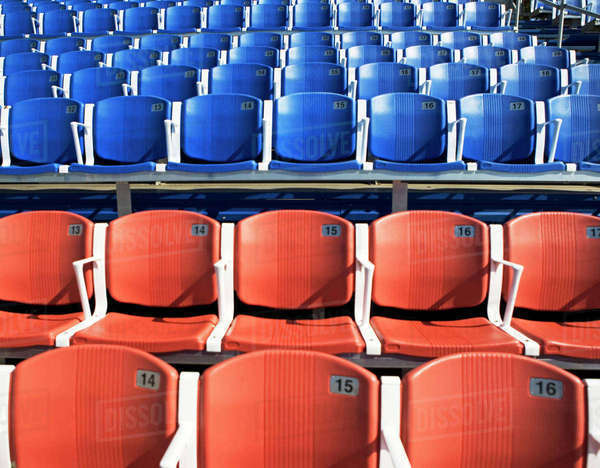
Where is `blue seats in the second row`? This screenshot has width=600, height=468. blue seats in the second row is located at coordinates (37, 81), (93, 85), (151, 81), (233, 80), (313, 72), (383, 72), (466, 75), (521, 76), (586, 82).